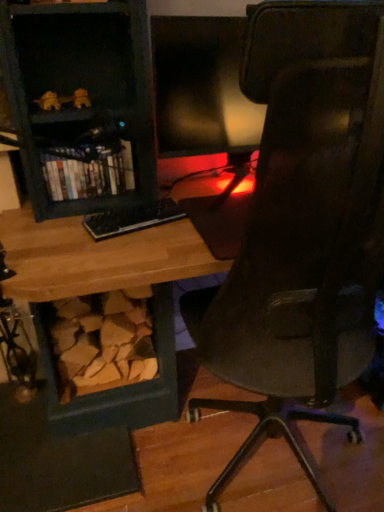
Question: Considering the positions of matte black bookshelf at left and black plastic keyboard at center in the image, is matte black bookshelf at left wider or thinner than black plastic keyboard at center?

Choices:
 (A) wide
 (B) thin

Answer: (A)

Question: Considering their positions, is matte black bookshelf at left located in front of or behind black plastic keyboard at center?

Choices:
 (A) behind
 (B) front

Answer: (A)

Question: Which of these objects is positioned farthest from the black plastic keyboard at center?

Choices:
 (A) matte black monitor at center
 (B) matte black bookshelf at left

Answer: (A)

Question: Estimate the real-world distances between objects in this image. Which object is farther from the black plastic keyboard at center?

Choices:
 (A) matte black bookshelf at left
 (B) matte black monitor at center

Answer: (B)